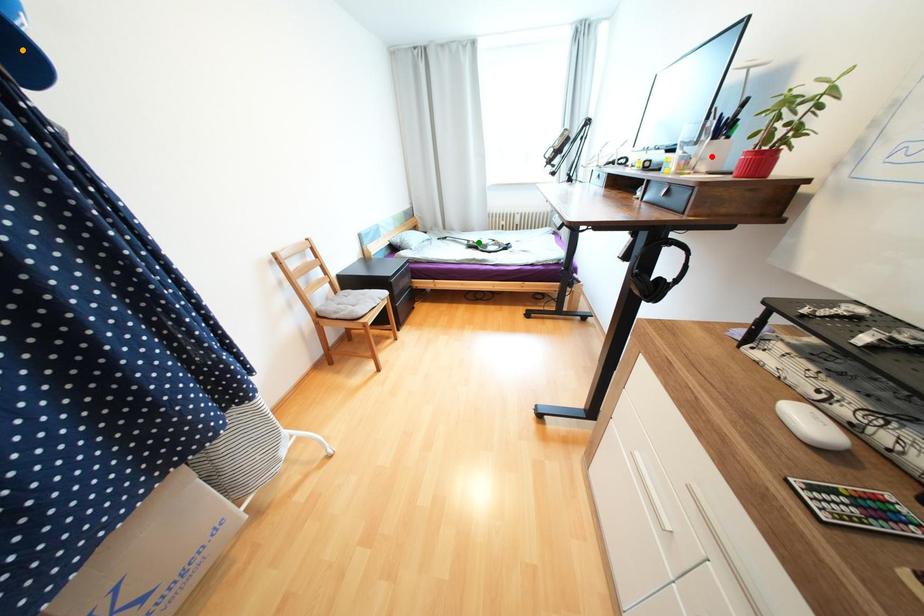
Order these from nearest to farthest:
red point
green point
orange point

orange point < red point < green point